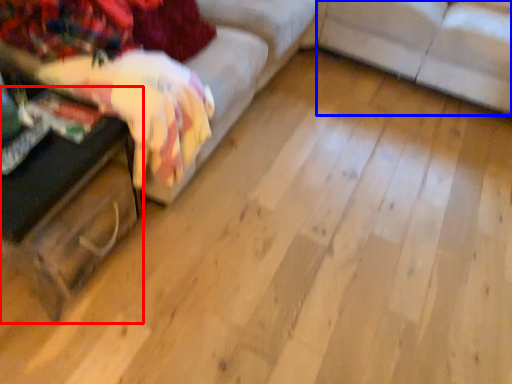
Question: Which point is closer to the camera, table (highlighted by a red box) or studio couch (highlighted by a blue box)?

Choices:
 (A) table
 (B) studio couch

Answer: (A)